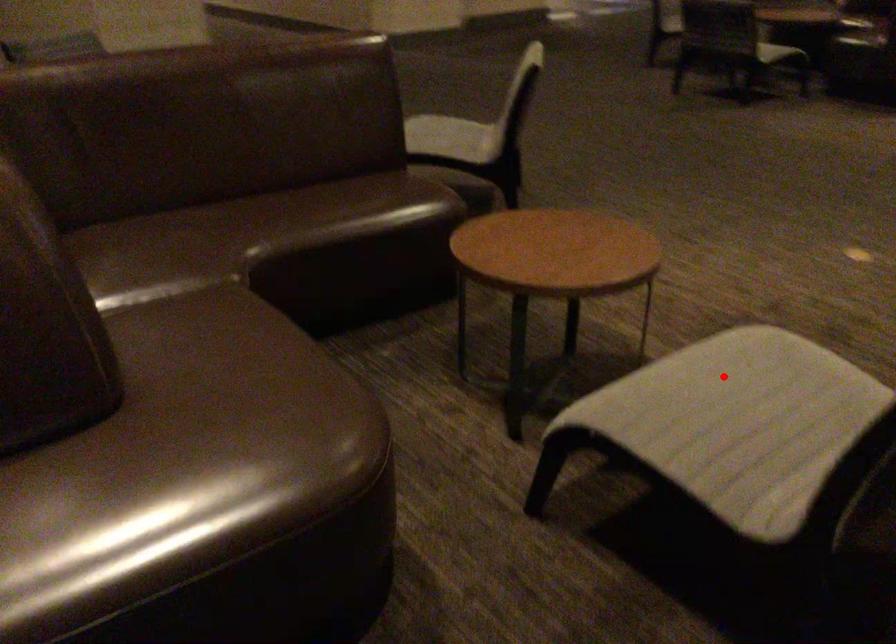
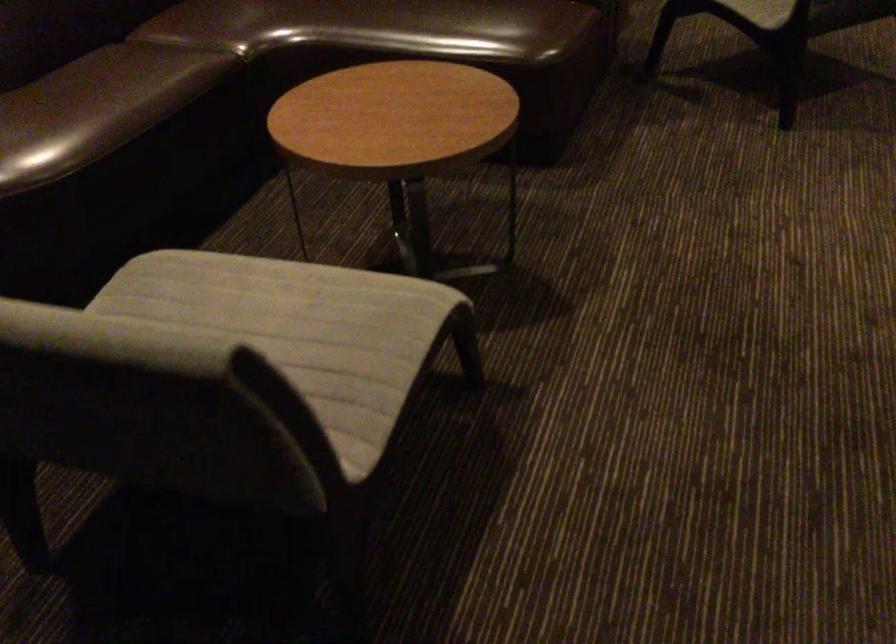
Question: I am providing you with two images of the same scene from different viewpoints. Given a red point in image1, look at the same physical point in image2. Is it:

Choices:
 (A) Closer to the viewpoint
 (B) Farther from the viewpoint

Answer: (A)